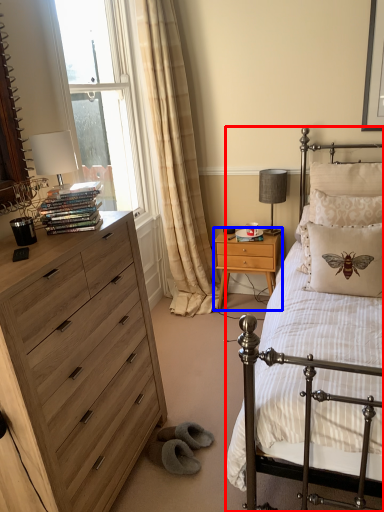
Question: Which object appears farthest to the camera in this image, bed (highlighted by a red box) or nightstand (highlighted by a blue box)?

Choices:
 (A) bed
 (B) nightstand

Answer: (B)